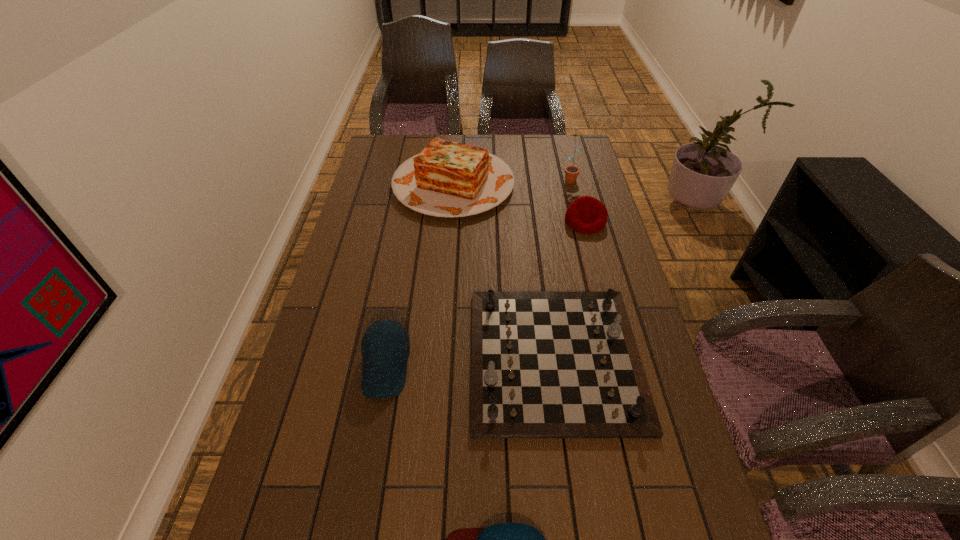
Identify the location of free space at the left edge of the desktop. Image resolution: width=960 pixels, height=540 pixels. (352, 329).

The width and height of the screenshot is (960, 540). In the image, there is a desktop. Identify the location of vacant space at the right edge. (563, 172).

This screenshot has height=540, width=960. Identify the location of free region at the far left corner of the desktop. (397, 157).

You are a GUI agent. You are given a task and a screenshot of the screen. Output one action in this format:
    pyautogui.click(x=<x>, y=<y>)
    Task: Click on the unoccupied position between the chessboard and the fourth shortest object
    
    Given the screenshot: What is the action you would take?
    pyautogui.click(x=470, y=362)

Where is `free space between the farther baseball cap and the tallest object`? The image size is (960, 540). free space between the farther baseball cap and the tallest object is located at coordinates (478, 272).

The height and width of the screenshot is (540, 960). I want to click on free spot between the sunflower and the chessboard, so click(563, 268).

In order to click on vacant space that's between the chessboard and the sunflower in this screenshot , I will do `click(563, 268)`.

Locate which object ranks fifth in proximity to the beanbag. Please provide its 2D coordinates. Your answer should be formatted as a tuple, i.e. [(x, y)], where the tuple contains the x and y coordinates of a point satisfying the conditions above.

[(510, 539)]

Identify the location of object that is the fourth closest to the beanbag. (385, 346).

Where is `free spot that satisfies the following two spatial constraints: 1. on the flower of the sunflower; 2. on the board of the chessboard`? free spot that satisfies the following two spatial constraints: 1. on the flower of the sunflower; 2. on the board of the chessboard is located at coordinates (614, 358).